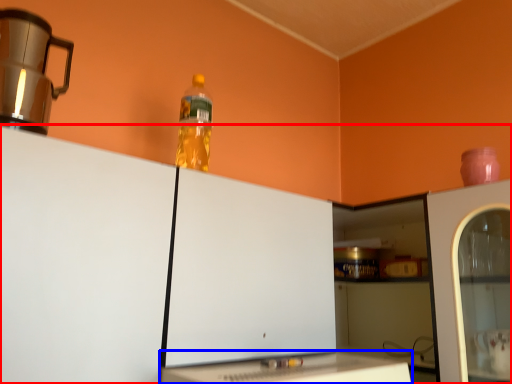
Question: Which of the following is the farthest to the observer, cabinetry (highlighted by a red box) or table (highlighted by a blue box)?

Choices:
 (A) cabinetry
 (B) table

Answer: (B)